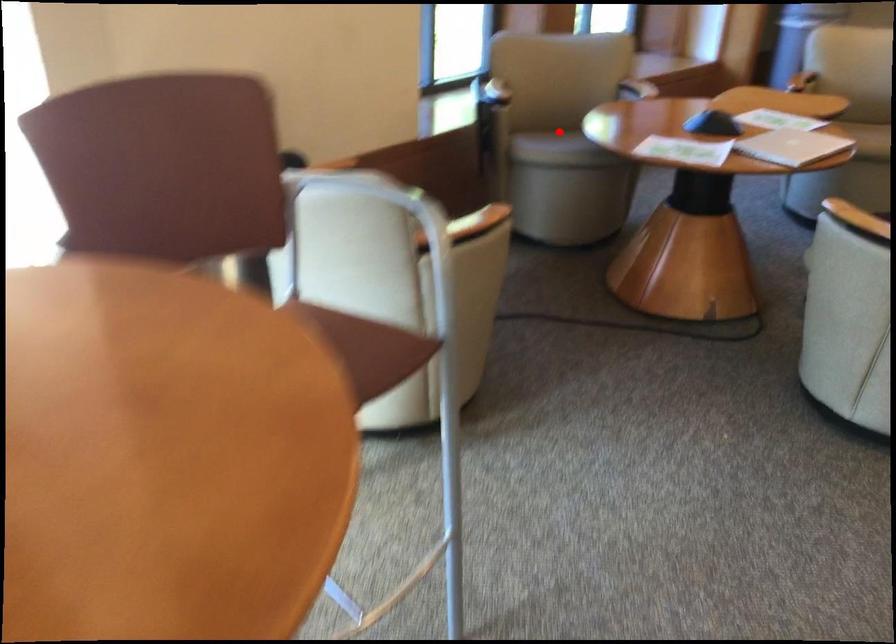
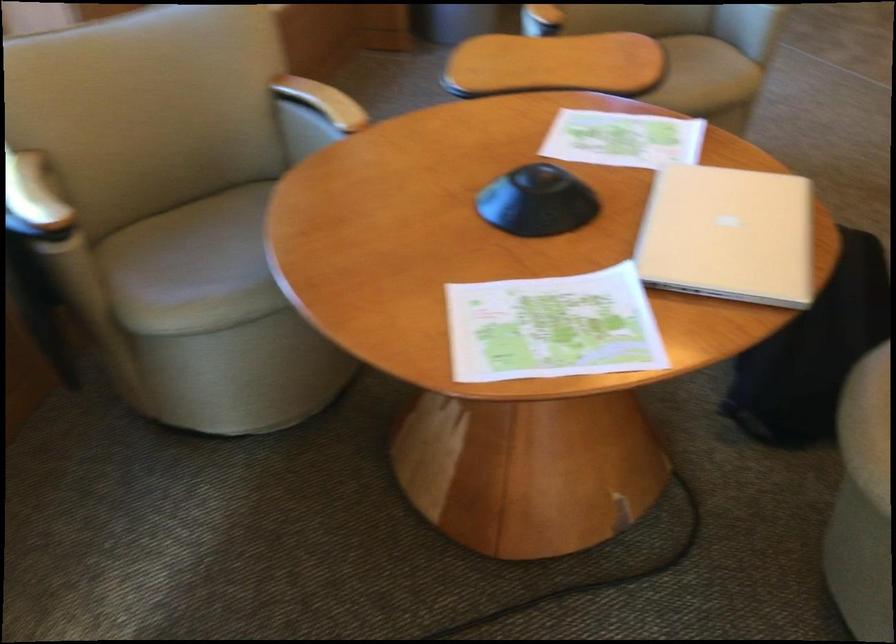
Find the pixel in the second image that matches the highlighted location in the first image.

(193, 267)